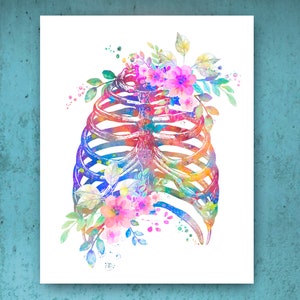
Identify the location of blue wall left of art. The image size is (300, 300). (10, 166).